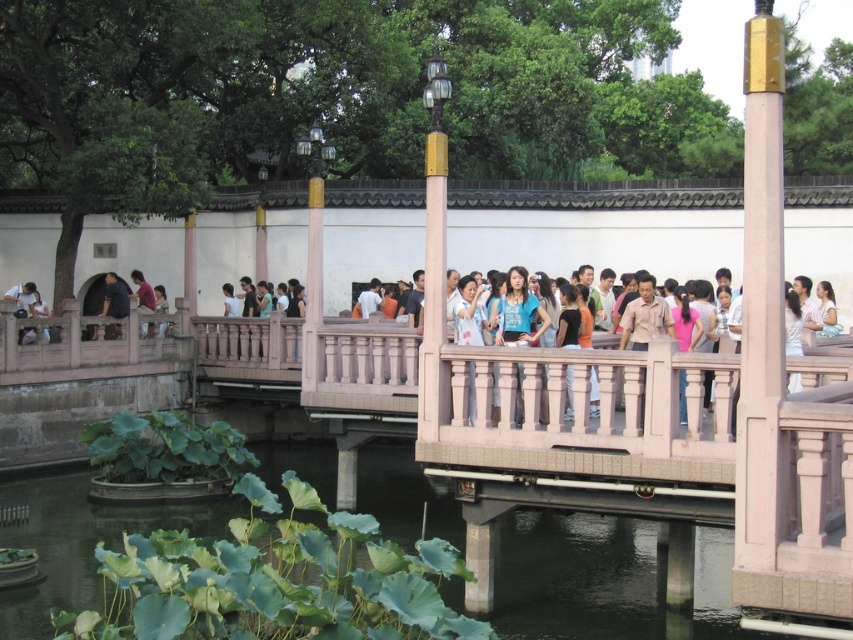
Who is positioned more to the left, dark gray shirt at left or light blue denim jeans at lower left?

Positioned to the left is dark gray shirt at left.

Can you confirm if dark gray shirt at left is wider than light blue denim jeans at lower left?

Indeed, dark gray shirt at left has a greater width compared to light blue denim jeans at lower left.

Between point (112, 300) and point (166, 305), which one is positioned in front?

Positioned in front is point (112, 300).

I want to click on dark gray shirt at left, so [x=115, y=296].

Identify the location of matte pink shirt at center. (142, 291).

Between point (131, 275) and point (154, 292), which one is positioned behind?

The point (131, 275) is behind.

Where is `matte pink shirt at center`? matte pink shirt at center is located at coordinates (142, 291).

Is point (114, 317) farther from camera compared to point (141, 332)?

No, it is in front of (141, 332).

Who is taller, dark gray shirt at left or matte pink shirt at center?

dark gray shirt at left is taller.

Who is more distant from viewer, [125,308] or [149,298]?

The point [149,298] is more distant.

The height and width of the screenshot is (640, 853). I want to click on dark gray shirt at left, so click(115, 296).